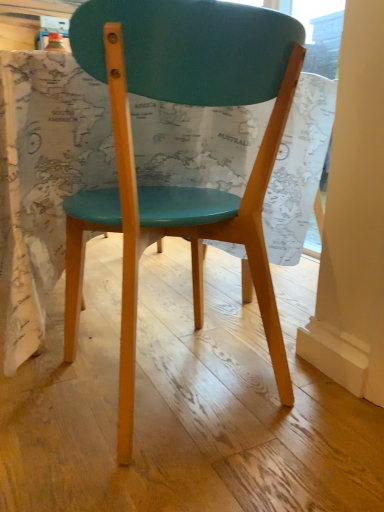
Where is `free region under teal matte wood chair at center (from a real-world perspective)`? The width and height of the screenshot is (384, 512). free region under teal matte wood chair at center (from a real-world perspective) is located at coordinates (177, 387).